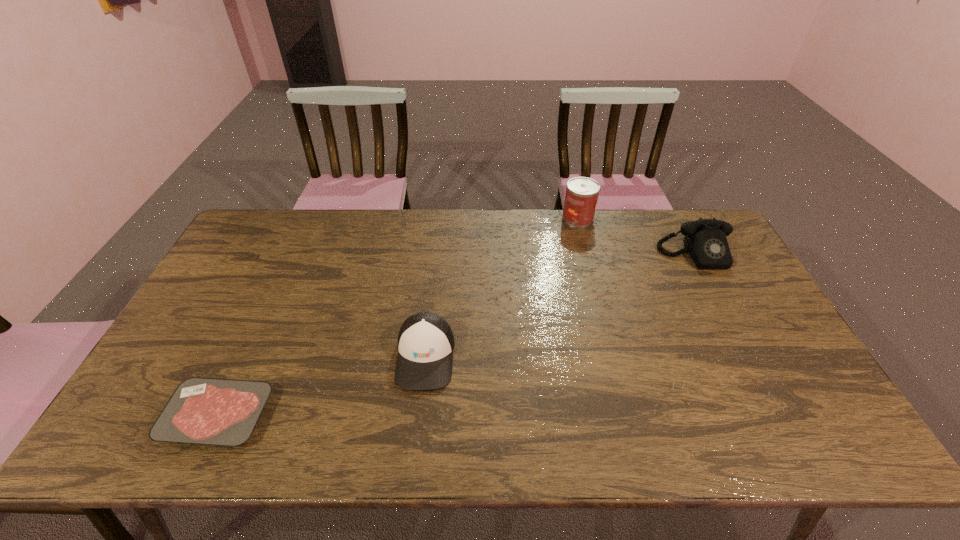
Where is `can`? can is located at coordinates (582, 193).

At what (x,y) coordinates should I click in order to perform the action: click on the tallest object. Please return your answer as a coordinate pair (x, y). The image size is (960, 540). Looking at the image, I should click on (582, 193).

You are a GUI agent. You are given a task and a screenshot of the screen. Output one action in this format:
    pyautogui.click(x=<x>, y=<y>)
    Task: Click on the telephone
    The width and height of the screenshot is (960, 540).
    Given the screenshot: What is the action you would take?
    pyautogui.click(x=705, y=240)

You are a GUI agent. You are given a task and a screenshot of the screen. Output one action in this format:
    pyautogui.click(x=<x>, y=<y>)
    Task: Click on the rightmost object
    The image size is (960, 540).
    Given the screenshot: What is the action you would take?
    pyautogui.click(x=705, y=240)

Image resolution: width=960 pixels, height=540 pixels. What are the coordinates of `the second object from left to right` in the screenshot? It's located at (425, 341).

This screenshot has height=540, width=960. In order to click on the leftmost object in this screenshot , I will do `click(210, 411)`.

Locate an element on the screen. Image resolution: width=960 pixels, height=540 pixels. the shortest object is located at coordinates (210, 411).

At what (x,y) coordinates should I click in order to perform the action: click on vacant space situated on the left of the can. Please return your answer as a coordinate pair (x, y). This screenshot has height=540, width=960. Looking at the image, I should click on (456, 218).

Find the location of a particular element. This screenshot has width=960, height=540. vacant point located on the dial of the telephone is located at coordinates (721, 306).

Find the location of a particular element. blank area located 0.120m on the front panel of the second object from left to right is located at coordinates (417, 440).